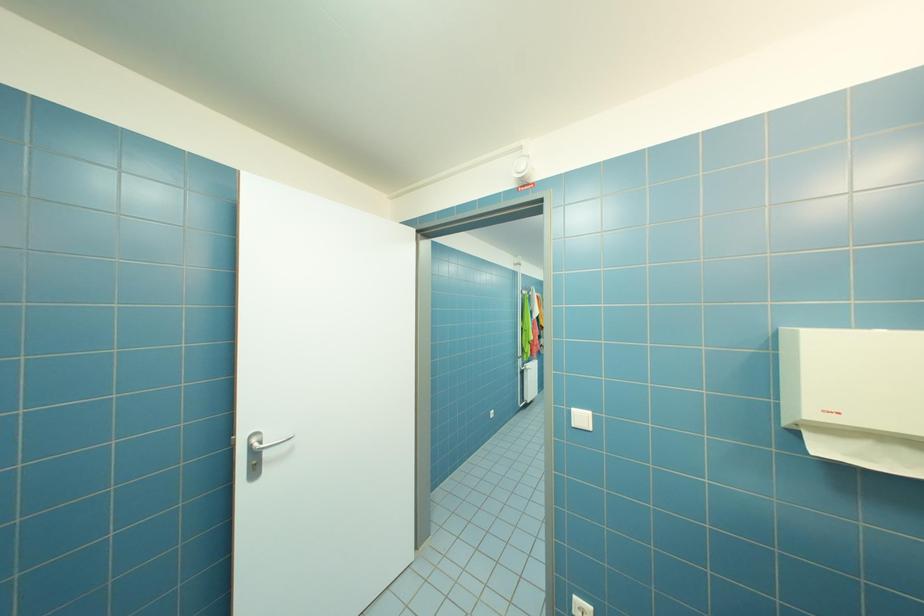
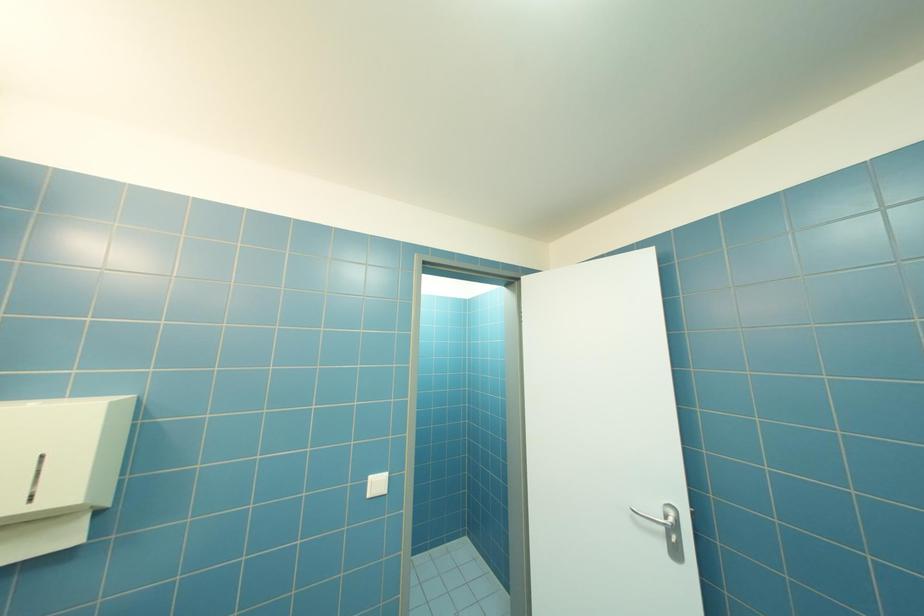
Question: The first image is from the beginning of the video and the second image is from the end. How did the camera likely rotate when shooting the video?

Choices:
 (A) Left
 (B) Right
 (C) Up
 (D) Down

Answer: (A)